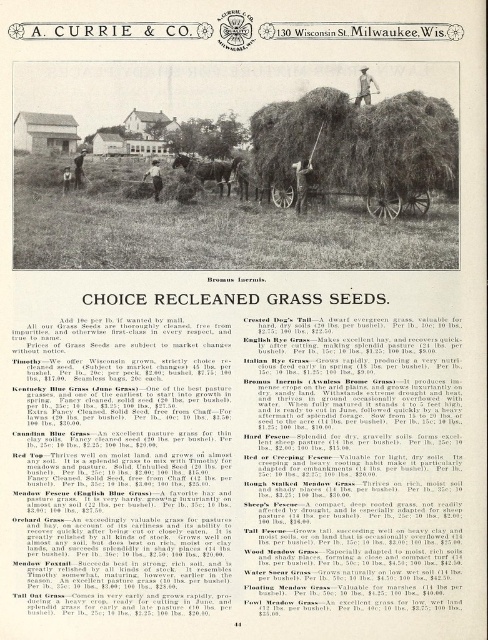
Question: Does green grass at center have a lesser width compared to brown wooden wagon at center?

Choices:
 (A) yes
 (B) no

Answer: (B)

Question: Which is nearer to the brown leather coach at center?

Choices:
 (A) green grass at center
 (B) dark brown horse at center
 (C) wooden coach at center

Answer: (A)

Question: Is green grass at center closer to the viewer compared to brown leather coach at center?

Choices:
 (A) yes
 (B) no

Answer: (A)

Question: Among these objects, which one is nearest to the camera?

Choices:
 (A) brown wooden wagon at center
 (B) wooden cart at center

Answer: (A)

Question: Is green grass at center positioned at the back of brown leather coach at center?

Choices:
 (A) yes
 (B) no

Answer: (B)

Question: Considering the real-world distances, which object is closest to the dark brown horse at center?

Choices:
 (A) brown leather coach at center
 (B) brown wooden wagon at center
 (C) green grass at center

Answer: (C)